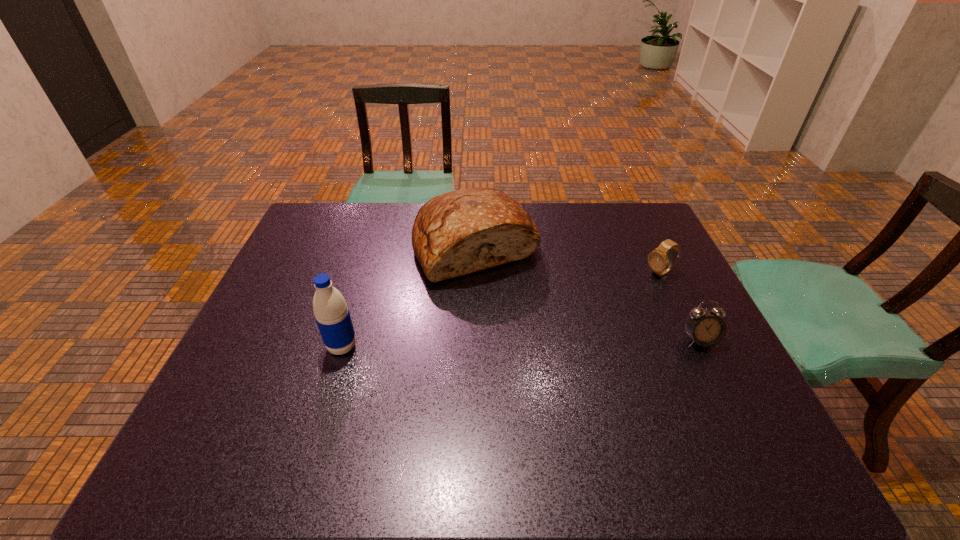
Identify the location of vacant point located between the bread and the alarm clock. The image size is (960, 540). (588, 293).

Image resolution: width=960 pixels, height=540 pixels. What are the coordinates of `the second closest object relative to the alarm clock` in the screenshot? It's located at (456, 233).

Select which object is the third closest to the leftmost object. Please provide its 2D coordinates. Your answer should be formatted as a tuple, i.e. [(x, y)], where the tuple contains the x and y coordinates of a point satisfying the conditions above.

[(660, 263)]